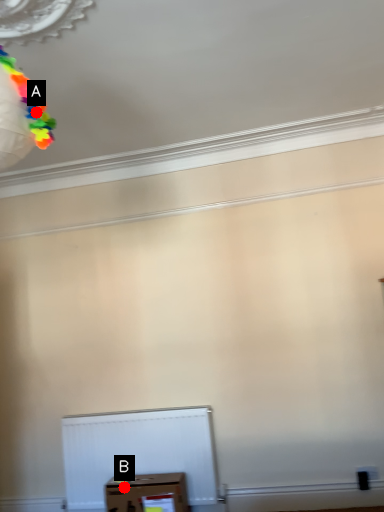
Question: Two points are circled on the image, labeled by A and B beside each circle. Which point is closer to the camera?

Choices:
 (A) A is closer
 (B) B is closer

Answer: (A)